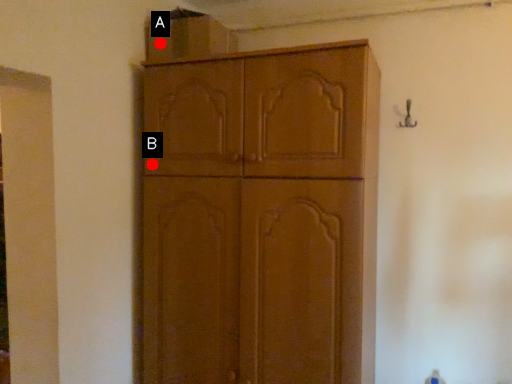
Question: Two points are circled on the image, labeled by A and B beside each circle. Which point is farther to the camera?

Choices:
 (A) A is further
 (B) B is further

Answer: (A)